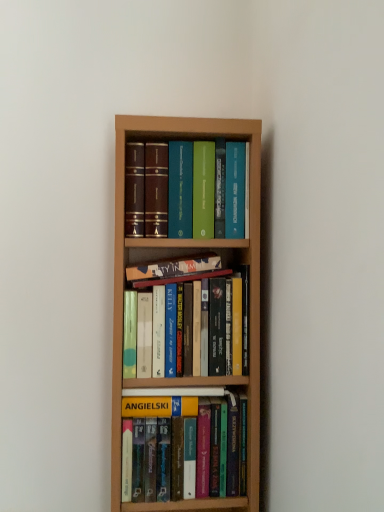
Question: Considering the relative positions of hardcover book at center, which ranks as the 4th book in top-to-bottom order, and hardcover books at center, arranged as the 2th book when ordered from the bottom, in the image provided, is hardcover book at center, which ranks as the 4th book in top-to-bottom order, to the left of hardcover books at center, arranged as the 2th book when ordered from the bottom, from the viewer's perspective?

Choices:
 (A) yes
 (B) no

Answer: (B)

Question: Is hardcover book at center, which ranks as the 4th book in top-to-bottom order, closer to camera compared to hardcover books at center, arranged as the 2th book when ordered from the bottom?

Choices:
 (A) yes
 (B) no

Answer: (B)

Question: Is there a large distance between hardcover book at center, the 1th book from the bottom, and hardcover books at center, arranged as the 2th book when ordered from the bottom?

Choices:
 (A) no
 (B) yes

Answer: (A)

Question: Is hardcover book at center, which ranks as the 4th book in top-to-bottom order, surrounding hardcover books at center, arranged as the 2th book when ordered from the bottom?

Choices:
 (A) yes
 (B) no

Answer: (B)

Question: Is hardcover book at center, the 1th book from the bottom, oriented away from hardcover books at center, the third book in the top-to-bottom sequence?

Choices:
 (A) no
 (B) yes

Answer: (A)

Question: From the image's perspective, relative to hardcover book at center, which ranks as the 4th book in top-to-bottom order, is hardcover books at center, arranged as the 2th book when ordered from the bottom, above or below?

Choices:
 (A) above
 (B) below

Answer: (A)

Question: From a real-world perspective, is hardcover books at center, arranged as the 2th book when ordered from the bottom, positioned above or below hardcover book at center, which ranks as the 4th book in top-to-bottom order?

Choices:
 (A) below
 (B) above

Answer: (B)

Question: Considering their positions, is hardcover books at center, the third book in the top-to-bottom sequence, located in front of or behind hardcover book at center, the 1th book from the bottom?

Choices:
 (A) behind
 (B) front

Answer: (B)

Question: Does point (155, 376) appear closer or farther from the camera than point (218, 445)?

Choices:
 (A) closer
 (B) farther

Answer: (A)

Question: In terms of height, does hardcover book at center, which ranks as the 4th book in top-to-bottom order, look taller or shorter compared to hardcover books at center, the third book in the top-to-bottom sequence?

Choices:
 (A) tall
 (B) short

Answer: (B)

Question: From a real-world perspective, relative to hardcover books at center, arranged as the 2th book when ordered from the bottom, is hardcover book at center, which ranks as the 4th book in top-to-bottom order, vertically above or below?

Choices:
 (A) below
 (B) above

Answer: (A)

Question: Choose the correct answer: Is hardcover book at center, which ranks as the 4th book in top-to-bottom order, inside hardcover books at center, the third book in the top-to-bottom sequence, or outside it?

Choices:
 (A) outside
 (B) inside

Answer: (A)

Question: From the image's perspective, is hardcover book at center, the 1th book from the bottom, positioned above or below hardcover books at center, the third book in the top-to-bottom sequence?

Choices:
 (A) below
 (B) above

Answer: (A)

Question: Considering the positions of point (193, 181) and point (157, 266), is point (193, 181) closer or farther from the camera than point (157, 266)?

Choices:
 (A) farther
 (B) closer

Answer: (B)

Question: In the image, is hardcover books at center, which is the fourth book in bottom-to-top order, positioned in front of or behind hardcover book at center, the second book in the top-to-bottom sequence?

Choices:
 (A) front
 (B) behind

Answer: (A)